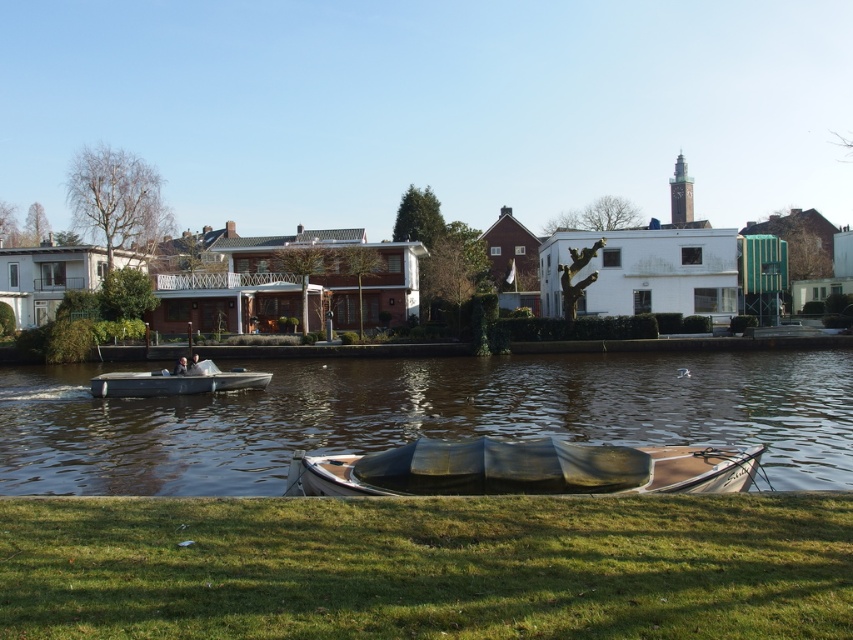
Question: Can you confirm if green grass at lower center is smaller than metallic gray motorboat at center-left?

Choices:
 (A) no
 (B) yes

Answer: (B)

Question: Among these points, which one is nearest to the camera?

Choices:
 (A) (550, 516)
 (B) (189, 390)
 (C) (728, 474)
 (D) (312, 451)

Answer: (A)

Question: Does wooden boat at center have a smaller size compared to metallic gray motorboat at center-left?

Choices:
 (A) no
 (B) yes

Answer: (B)

Question: Which of the following is the closest to the observer?

Choices:
 (A) (173, 381)
 (B) (695, 362)

Answer: (A)

Question: From the image, what is the correct spatial relationship of smooth brown water at lower center in relation to wooden boat at center?

Choices:
 (A) below
 (B) above

Answer: (A)

Question: Which object is the closest to the metallic gray motorboat at center-left?

Choices:
 (A) smooth brown water at lower center
 (B) green grass at lower center
 (C) wooden boat at center

Answer: (A)